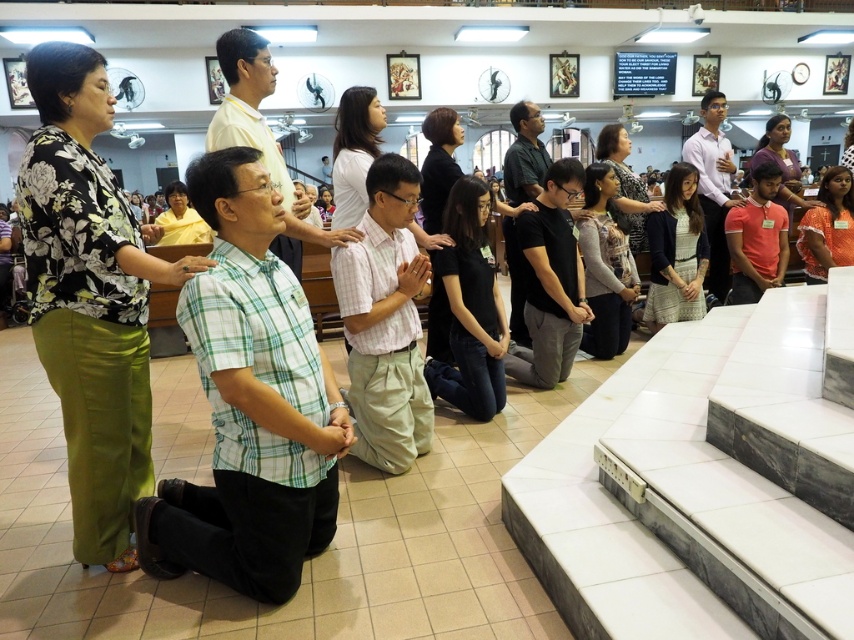
Is black matte shirt at center closer to camera compared to dark green shirt at center?

Yes, black matte shirt at center is in front of dark green shirt at center.

Does point (550, 182) come closer to viewer compared to point (531, 195)?

Yes, point (550, 182) is closer to viewer.

The width and height of the screenshot is (854, 640). Find the location of `black matte shirt at center`. black matte shirt at center is located at coordinates (550, 282).

Can you confirm if green plaid shirt at center is thinner than white shirt at center?

Incorrect, green plaid shirt at center's width is not less than white shirt at center's.

Who is taller, green plaid shirt at center or white shirt at center?

Standing taller between the two is white shirt at center.

Is point (323, 417) more distant than point (712, 276)?

No, it is not.

Where is `green plaid shirt at center`? This screenshot has height=640, width=854. green plaid shirt at center is located at coordinates (249, 404).

Can you confirm if white shirt at center is bigger than dark green shirt at center?

Yes.

Which is in front, point (740, 204) or point (525, 173)?

Point (525, 173)

Identify the location of white shirt at center. pos(712,188).